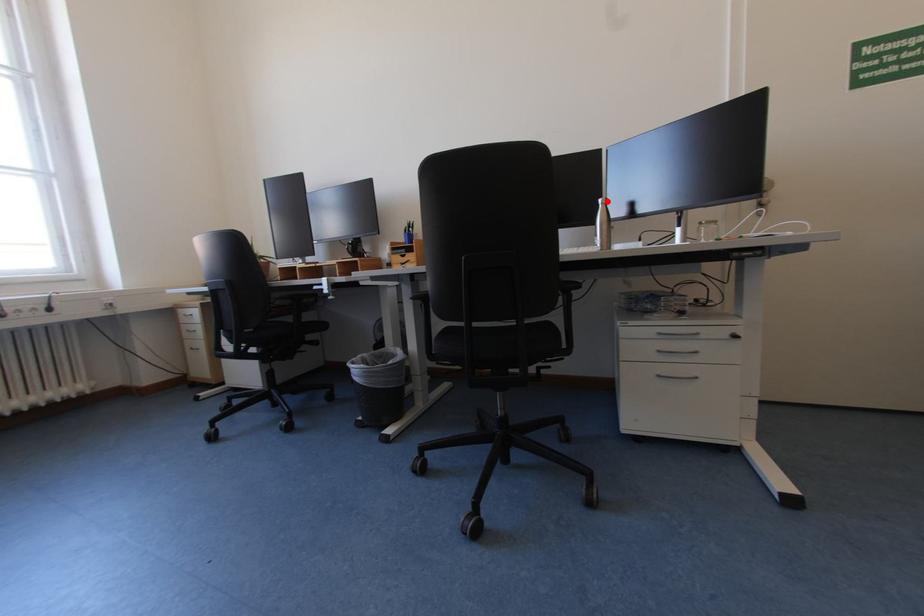
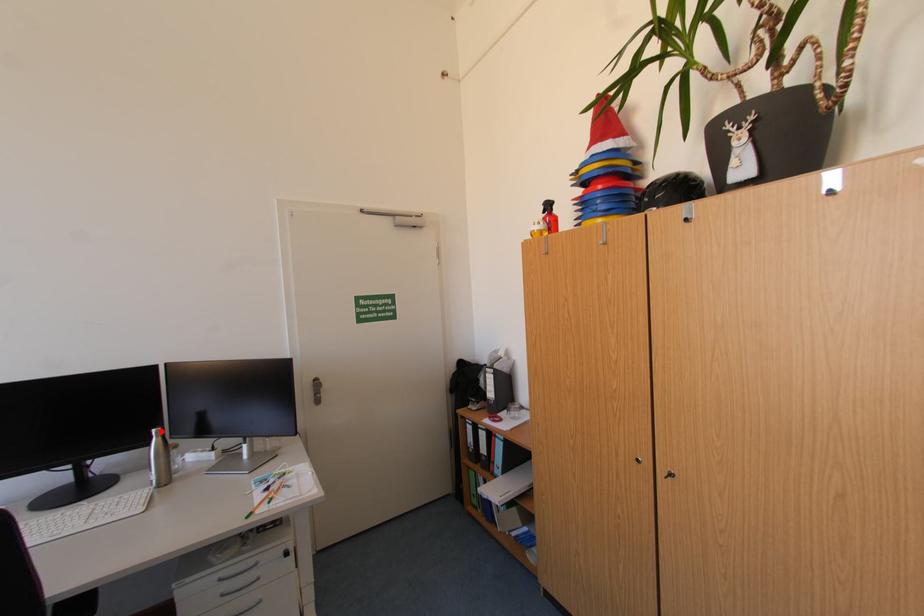
Consider the image. I am providing you with two images of the same scene from different viewpoints. A red point is marked on the first image and another point is marked on the second image. Is the red point in image1 aligned with the point shown in image2?

Yes